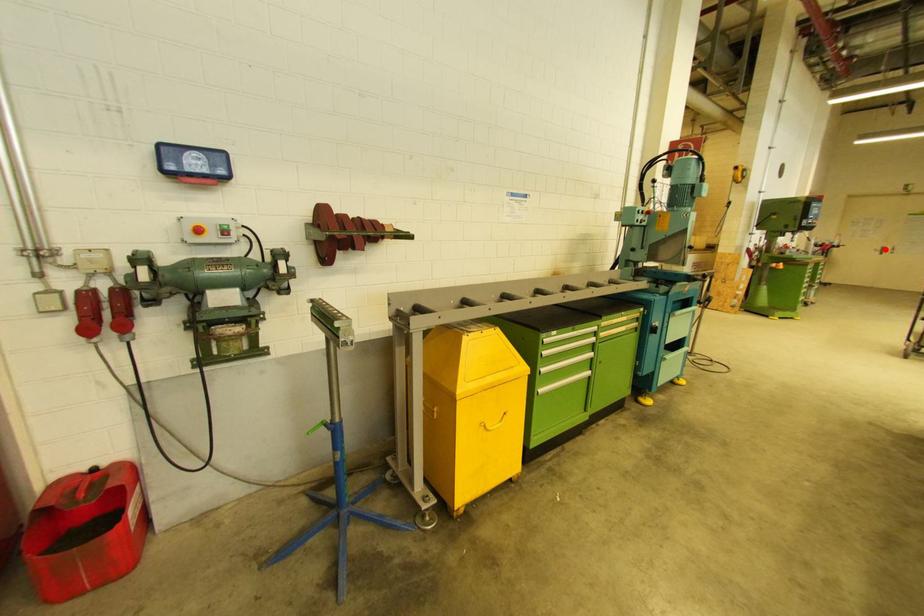
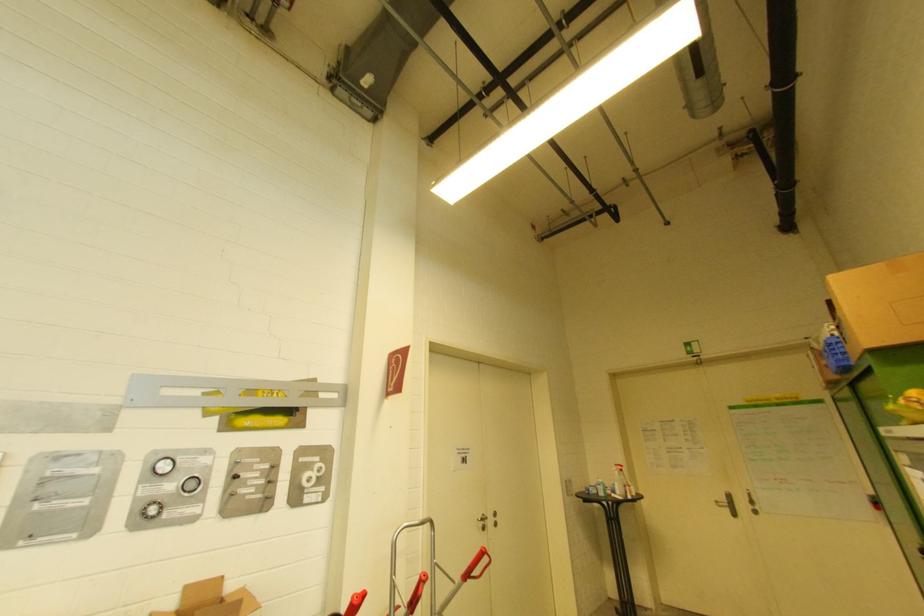
Question: I am providing you with two images of the same scene from different viewpoints. In image1, a red point is highlighted. Considering the same 3D point in image2, which of the following is correct?

Choices:
 (A) It is closer
 (B) It is farther

Answer: (A)